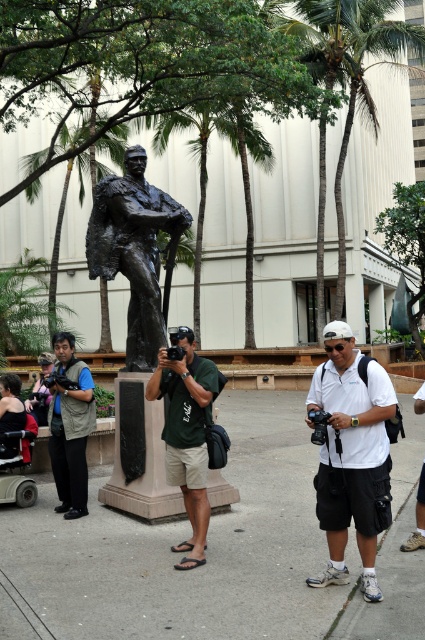
Question: Does gray concrete pavement at center appear under bronze statue at center?

Choices:
 (A) no
 (B) yes

Answer: (B)

Question: Which point is farther to the camera?

Choices:
 (A) (96, 252)
 (B) (11, 449)
 (C) (329, 4)
 (D) (50, 426)

Answer: (C)

Question: From the image, what is the correct spatial relationship of white matte shirt at center in relation to bronze statue at center?

Choices:
 (A) above
 (B) below

Answer: (B)

Question: Is bronze statue at center positioned behind green fabric shirt at center?

Choices:
 (A) yes
 (B) no

Answer: (A)

Question: Among these points, which one is nearest to the camera?

Choices:
 (A) (377, 42)
 (B) (42, 413)
 (C) (359, 432)
 (D) (20, 406)

Answer: (C)

Question: Which point is closer to the camera?

Choices:
 (A) red fabric wheelchair at lower left
 (B) gray concrete pavement at center
 (C) white matte shirt at center
 (D) green leafy palm tree at center

Answer: (B)